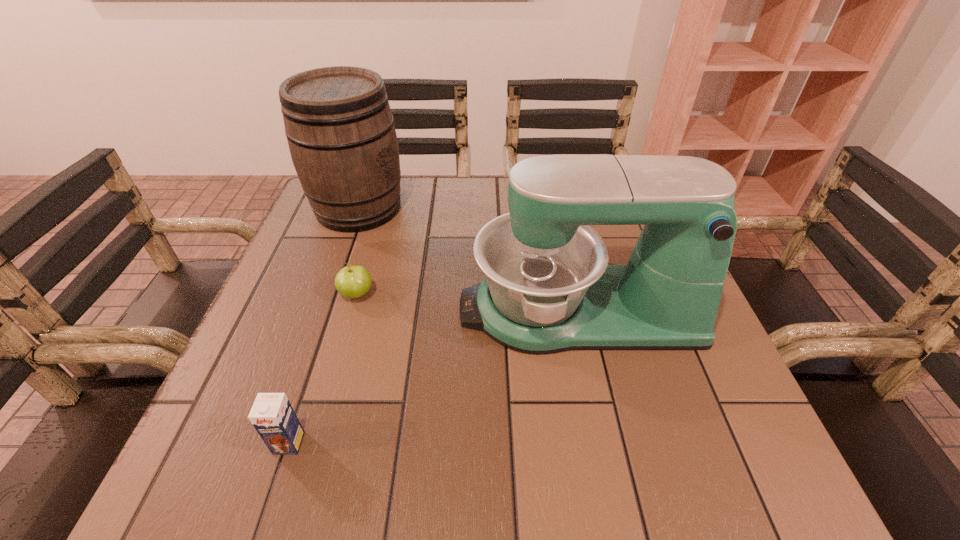
Locate an element on the screen. This screenshot has width=960, height=540. unoccupied position between the apple and the third tallest object is located at coordinates (323, 369).

Find the location of a particular element. The image size is (960, 540). vacant region between the mixer and the farthest object is located at coordinates (468, 259).

Locate an element on the screen. The image size is (960, 540). object that ranks as the closest to the third tallest object is located at coordinates (353, 281).

Identify which object is located as the nearest to the apple. Please provide its 2D coordinates. Your answer should be formatted as a tuple, i.e. [(x, y)], where the tuple contains the x and y coordinates of a point satisfying the conditions above.

[(341, 135)]

Find the location of a particular element. This screenshot has width=960, height=540. vacant region that satisfies the following two spatial constraints: 1. on the front-facing side of the mixer; 2. on the front label of the chocolate milk is located at coordinates (607, 443).

At what (x,y) coordinates should I click in order to perform the action: click on free space that satisfies the following two spatial constraints: 1. on the front-facing side of the mixer; 2. on the front label of the chocolate milk. Please return your answer as a coordinate pair (x, y). Looking at the image, I should click on (607, 443).